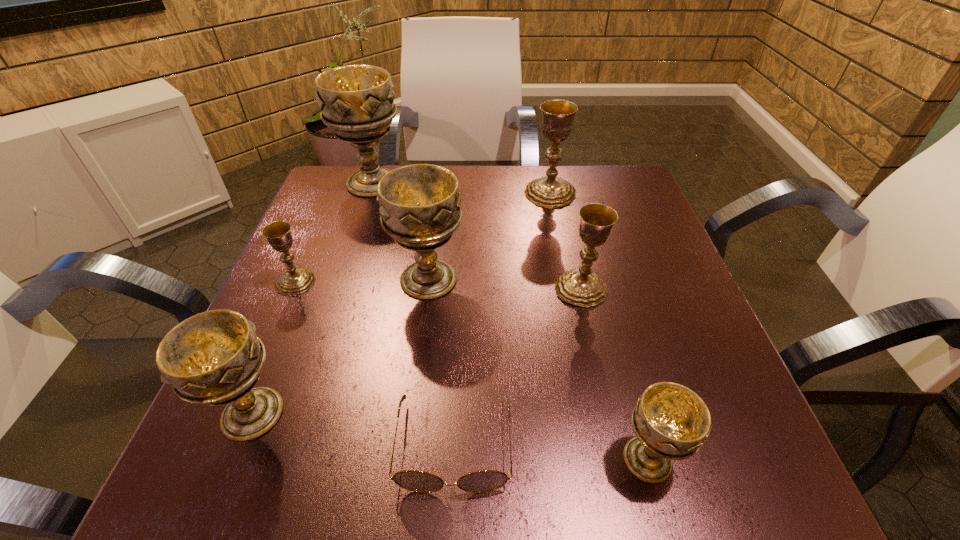
Identify the location of the biggest white chalice. The image size is (960, 540). (356, 102).

Where is `the tallest chalice`? the tallest chalice is located at coordinates (356, 102).

Locate an element on the screen. the farthest gold chalice is located at coordinates (550, 191).

Where is `the second farthest white chalice`? The width and height of the screenshot is (960, 540). the second farthest white chalice is located at coordinates [x=420, y=204].

Where is `the third smallest white chalice`? The width and height of the screenshot is (960, 540). the third smallest white chalice is located at coordinates (420, 204).

I want to click on the second biggest gold chalice, so click(580, 287).

Identify the location of the second smallest white chalice. (214, 358).

At what (x,y) coordinates should I click in order to perform the action: click on the leftmost gold chalice. Please return your answer as a coordinate pair (x, y). The height and width of the screenshot is (540, 960). Looking at the image, I should click on (295, 281).

The image size is (960, 540). Identify the location of the smallest white chalice. (671, 421).

Identify the location of the shortest object. This screenshot has width=960, height=540. pos(482,481).